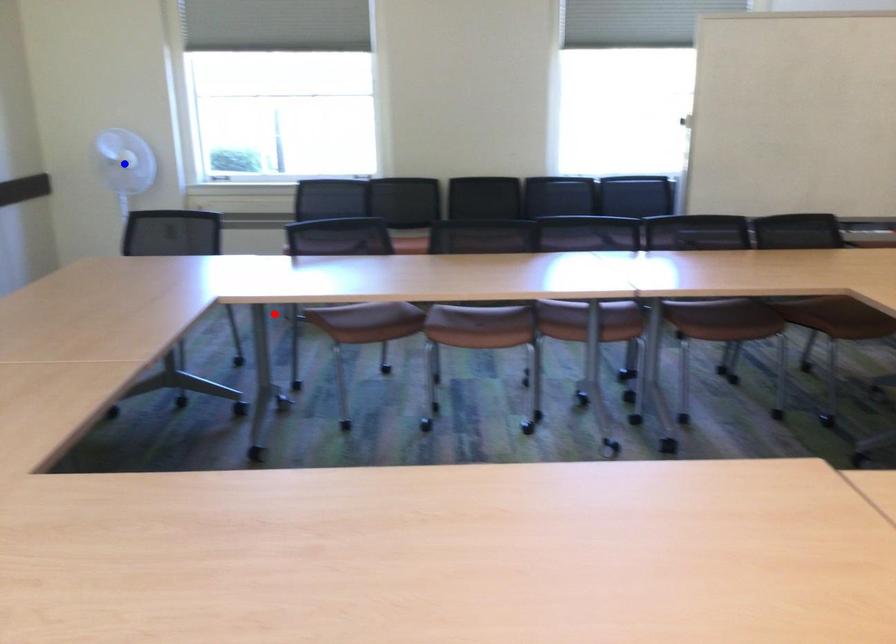
Question: Two points are marked on the image. Which point is closer to the camera?

Choices:
 (A) Blue point is closer.
 (B) Red point is closer.

Answer: (B)